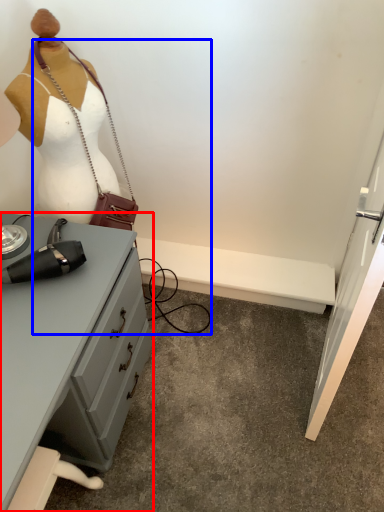
Question: Which object appears farthest to the camera in this image, desk (highlighted by a red box) or accessory (highlighted by a blue box)?

Choices:
 (A) desk
 (B) accessory

Answer: (B)